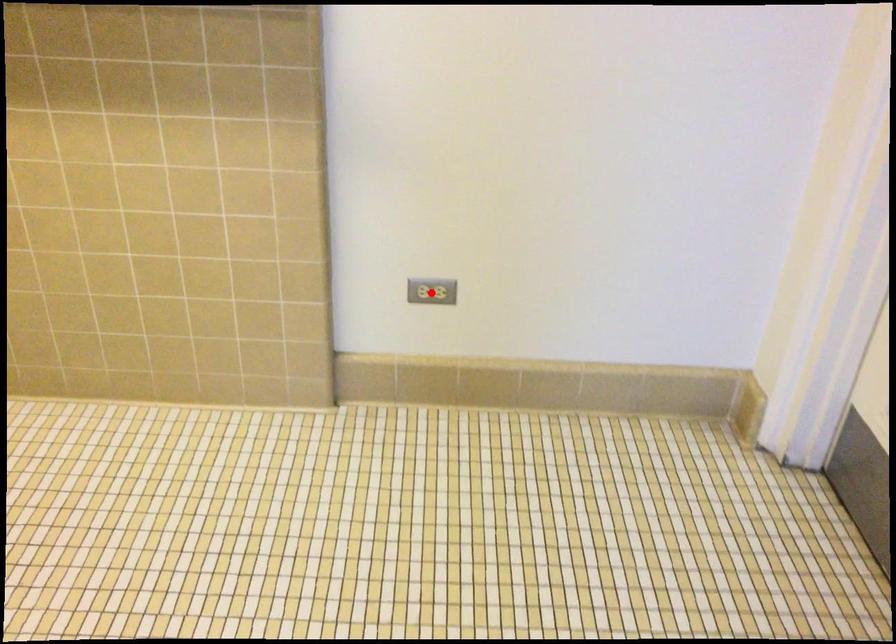
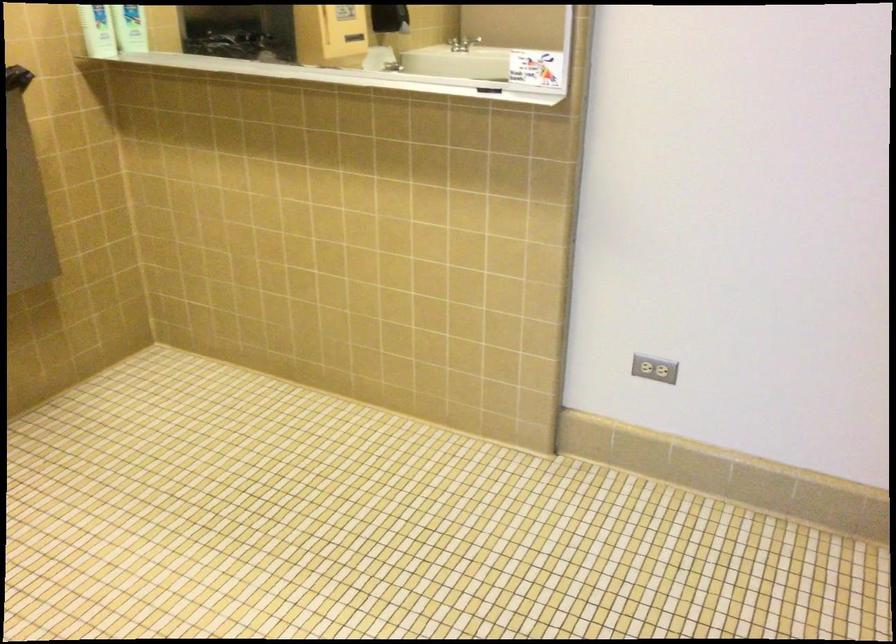
Locate, in the second image, the point that corresponds to the highlighted location in the first image.

(655, 368)